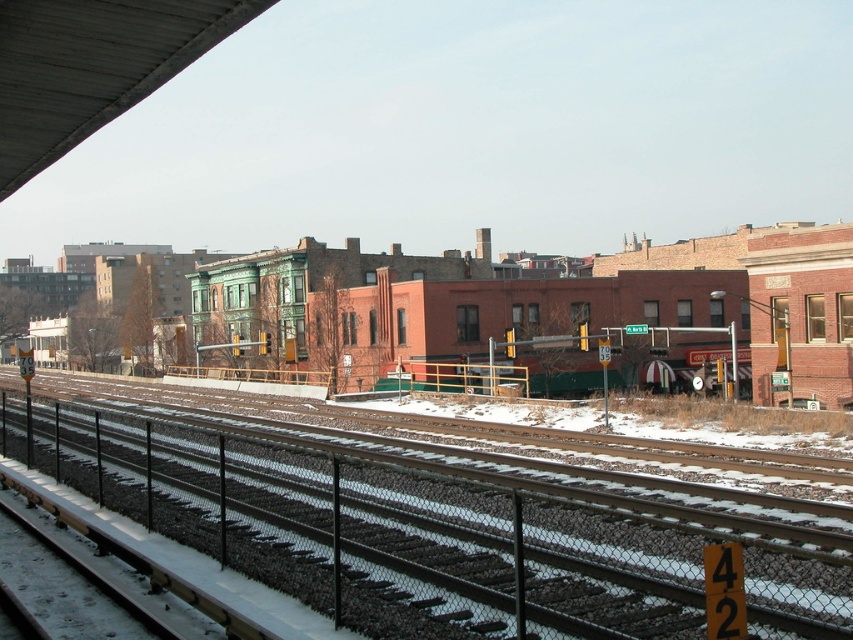
Question: Among these points, which one is farthest from the camera?

Choices:
 (A) (374, 616)
 (B) (137, 42)

Answer: (B)

Question: Which point is farther to the camera?

Choices:
 (A) metallic gray overpass at upper left
 (B) smooth asphalt tracks at center

Answer: (A)

Question: Can you confirm if smooth asphalt tracks at center is thinner than metallic gray overpass at upper left?

Choices:
 (A) no
 (B) yes

Answer: (A)

Question: Can you confirm if smooth asphalt tracks at center is positioned below metallic gray overpass at upper left?

Choices:
 (A) no
 (B) yes

Answer: (B)

Question: Is smooth asphalt tracks at center bigger than metallic gray overpass at upper left?

Choices:
 (A) yes
 (B) no

Answer: (A)